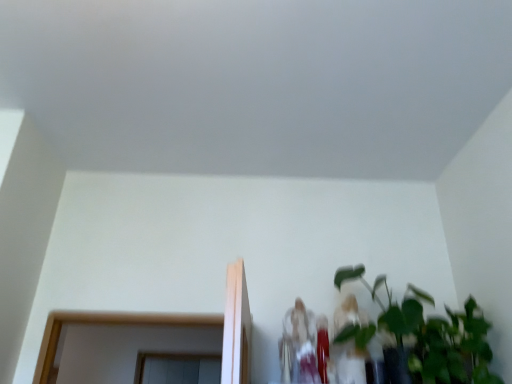
Identify the location of green leafy plant at right. This screenshot has width=512, height=384. (426, 335).

What do you see at coordinates (426, 335) in the screenshot? The image size is (512, 384). I see `green leafy plant at right` at bounding box center [426, 335].

Measure the distance between point (434,358) and camera.

Point (434,358) and camera are 1.46 meters apart from each other.

What is the approximate width of green leafy plant at right?

51.16 centimeters.

Identify the location of green leafy plant at right. [x=426, y=335].